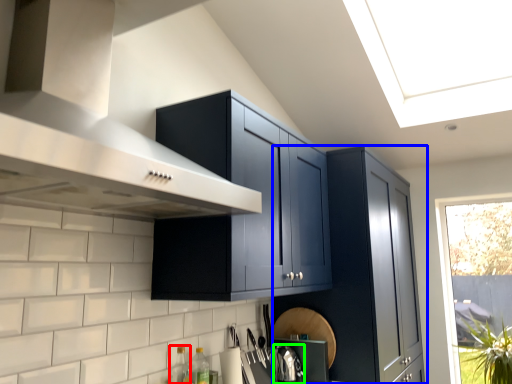
Question: Which object is the closest to the bottle (highlighted by a red box)? Choose among these: cabinetry (highlighted by a blue box) or appliance (highlighted by a green box).

Choices:
 (A) cabinetry
 (B) appliance

Answer: (B)